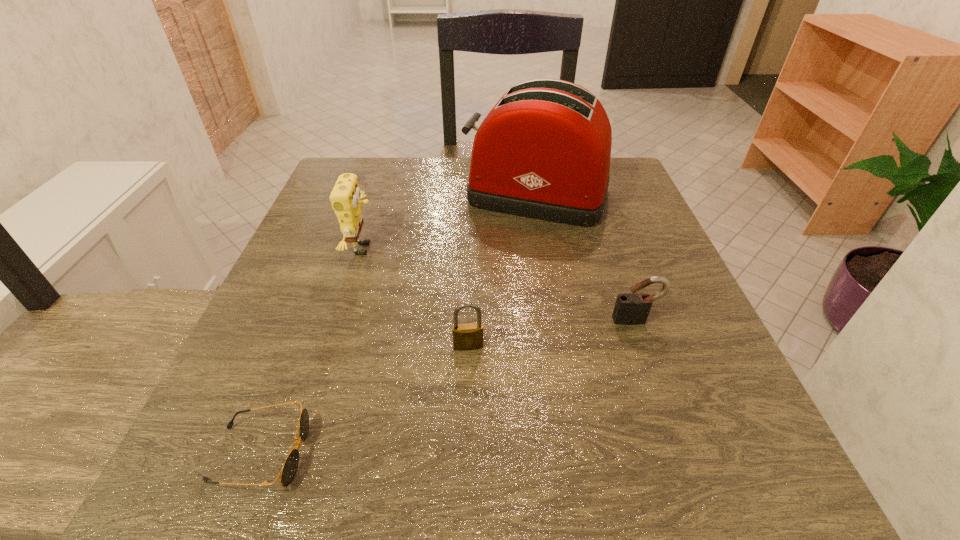
This screenshot has width=960, height=540. What are the coordinates of `vacant region located 0.160m with the keyhole on the front of the right padlock` in the screenshot? It's located at (667, 409).

The height and width of the screenshot is (540, 960). Find the location of `vacant space located on the right of the left padlock`. vacant space located on the right of the left padlock is located at coordinates (632, 346).

You are a GUI agent. You are given a task and a screenshot of the screen. Output one action in this format:
    pyautogui.click(x=<x>, y=<y>)
    Task: Click on the free space located 0.210m on the lenses of the nearest object
    The image size is (960, 540).
    Given the screenshot: What is the action you would take?
    pyautogui.click(x=465, y=453)

Find the location of a particular element. This screenshot has height=540, width=960. object present at the far edge is located at coordinates (543, 152).

This screenshot has width=960, height=540. I want to click on object positioned at the near edge, so click(x=290, y=466).

Identify the location of sponge that is at the left edge. This screenshot has width=960, height=540. (345, 197).

The height and width of the screenshot is (540, 960). In order to click on sunglasses present at the left edge in this screenshot , I will do point(290,466).

In order to click on toaster that is at the right edge in this screenshot , I will do `click(543, 152)`.

Locate an element on the screen. This screenshot has height=540, width=960. padlock at the right edge is located at coordinates (633, 307).

Find the location of a particular element. The height and width of the screenshot is (540, 960). object at the near left corner is located at coordinates (290, 466).